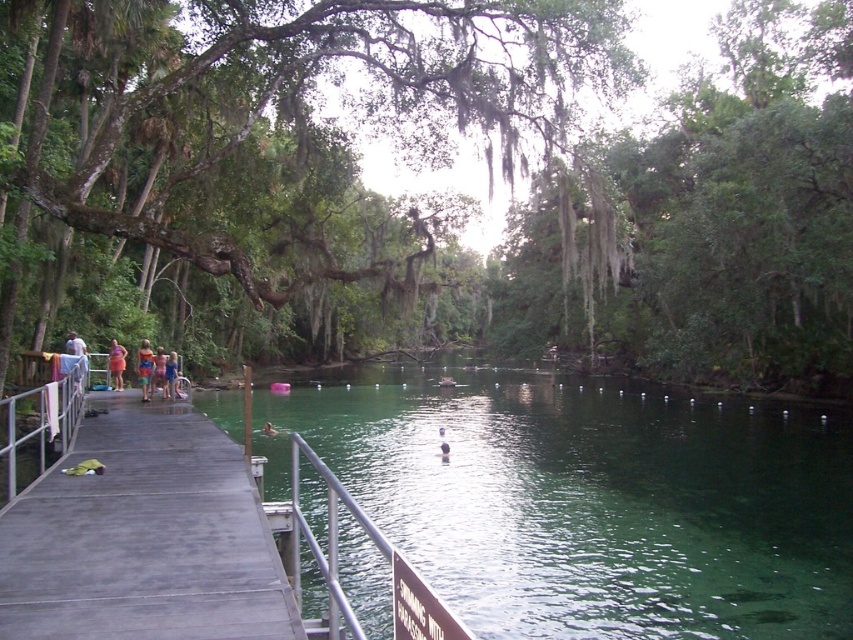
Question: Which object is farther from the camera taking this photo?

Choices:
 (A) blue fabric dress at center
 (B) white cotton shirt at left
 (C) orange fabric dress at center
 (D) blue denim shorts at left

Answer: (C)

Question: From the image, what is the correct spatial relationship of metal/rustic rail at lower center in relation to blue denim shorts at left?

Choices:
 (A) right
 (B) left

Answer: (A)

Question: Estimate the real-world distances between objects in this image. Which object is farther from the white cotton shirt at left?

Choices:
 (A) metal/rustic rail at lower center
 (B) orange fabric dress at left

Answer: (A)

Question: Which object is positioned closest to the orange fabric dress at center?

Choices:
 (A) gray wooden dock at left
 (B) blue fabric dress at center
 (C) green translucent water at center

Answer: (B)

Question: Does gray wooden dock at left have a greater width compared to blue denim shorts at left?

Choices:
 (A) yes
 (B) no

Answer: (A)

Question: Does green mossy tree at upper center have a greater width compared to blue fabric dress at center?

Choices:
 (A) no
 (B) yes

Answer: (B)